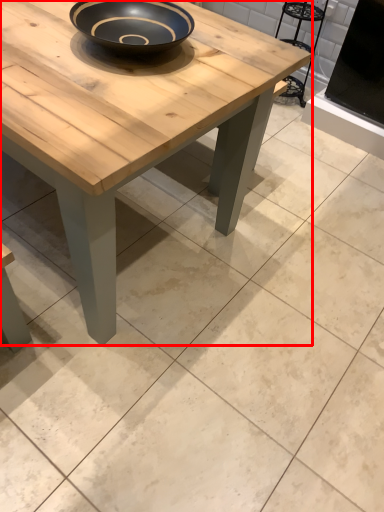
Question: From the image's perspective, where is coffee table (annotated by the red box) located in relation to chair in the image?

Choices:
 (A) below
 (B) above

Answer: (A)